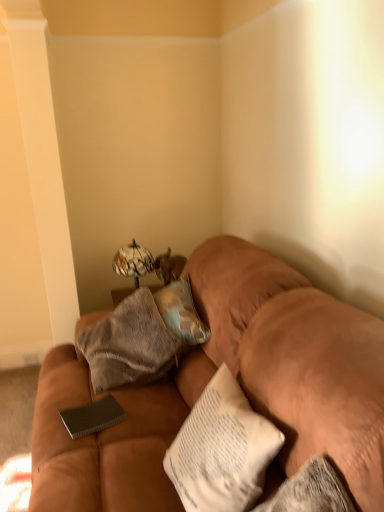
Question: Can you confirm if suede brown couch at center is taller than black textured notebook at center?

Choices:
 (A) no
 (B) yes

Answer: (B)

Question: From the image's perspective, is suede brown couch at center on top of black textured notebook at center?

Choices:
 (A) no
 (B) yes

Answer: (B)

Question: Is suede brown couch at center positioned with its back to black textured notebook at center?

Choices:
 (A) yes
 (B) no

Answer: (B)

Question: Is the position of suede brown couch at center more distant than that of black textured notebook at center?

Choices:
 (A) no
 (B) yes

Answer: (A)

Question: Is suede brown couch at center beside black textured notebook at center?

Choices:
 (A) yes
 (B) no

Answer: (B)

Question: In terms of size, does suede brown couch at center appear bigger or smaller than marble-patterned glass table lamp at upper center?

Choices:
 (A) small
 (B) big

Answer: (B)

Question: In the image, is suede brown couch at center on the left side or the right side of marble-patterned glass table lamp at upper center?

Choices:
 (A) left
 (B) right

Answer: (B)

Question: Is point (79, 458) closer or farther from the camera than point (127, 262)?

Choices:
 (A) closer
 (B) farther

Answer: (A)

Question: Do you think suede brown couch at center is within marble-patterned glass table lamp at upper center, or outside of it?

Choices:
 (A) inside
 (B) outside

Answer: (B)

Question: From the image's perspective, is textured beige pillow at center above or below marble-patterned glass table lamp at upper center?

Choices:
 (A) below
 (B) above

Answer: (A)

Question: Is textured beige pillow at center bigger or smaller than marble-patterned glass table lamp at upper center?

Choices:
 (A) big
 (B) small

Answer: (B)

Question: Is textured beige pillow at center situated inside marble-patterned glass table lamp at upper center or outside?

Choices:
 (A) inside
 (B) outside

Answer: (B)

Question: From a real-world perspective, is textured beige pillow at center above or below marble-patterned glass table lamp at upper center?

Choices:
 (A) below
 (B) above

Answer: (B)

Question: From a real-world perspective, is black textured notebook at center above or below textured beige pillow at center?

Choices:
 (A) above
 (B) below

Answer: (B)

Question: Based on their sizes in the image, would you say black textured notebook at center is bigger or smaller than textured beige pillow at center?

Choices:
 (A) small
 (B) big

Answer: (A)